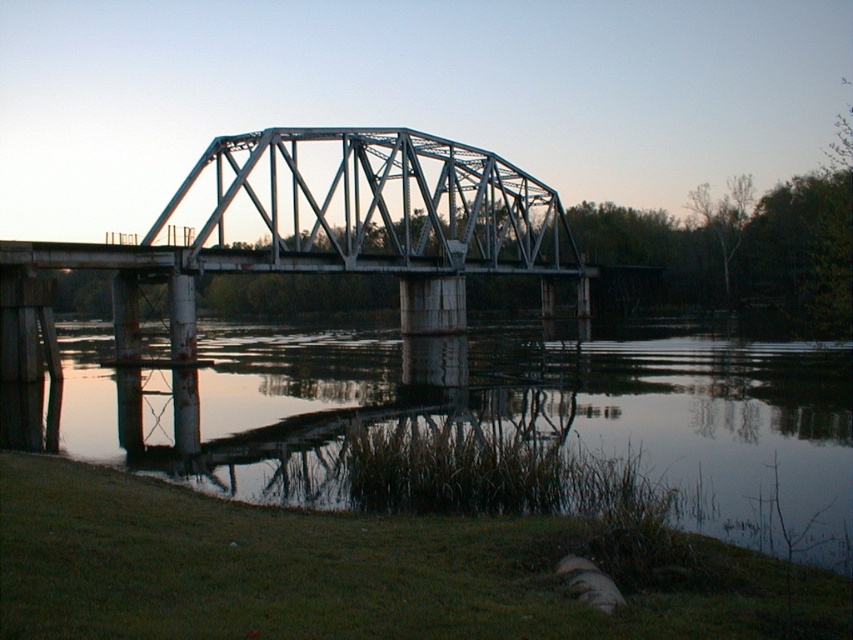
You are a photographer planning to capture the metallic gray bridge at center and the smooth reflective water at lower center in a single frame. Based on their sizes, which object should you focus on first to ensure both are in the frame?

The smooth reflective water at lower center is shorter than the metallic gray bridge at center, so you should focus on the metallic gray bridge at center first as it is larger and will require more attention to fit into the frame properly.

You are standing on the metal truss bridge and want to find the smooth reflective water at lower center. According to the coordinates provided, where should you look relative to your position on the bridge?

The smooth reflective water at lower center is located at point 0.644 on the x axis and 0.565 on the y axis relative to the image frame, so you should look towards the lower center direction from your position on the bridge.